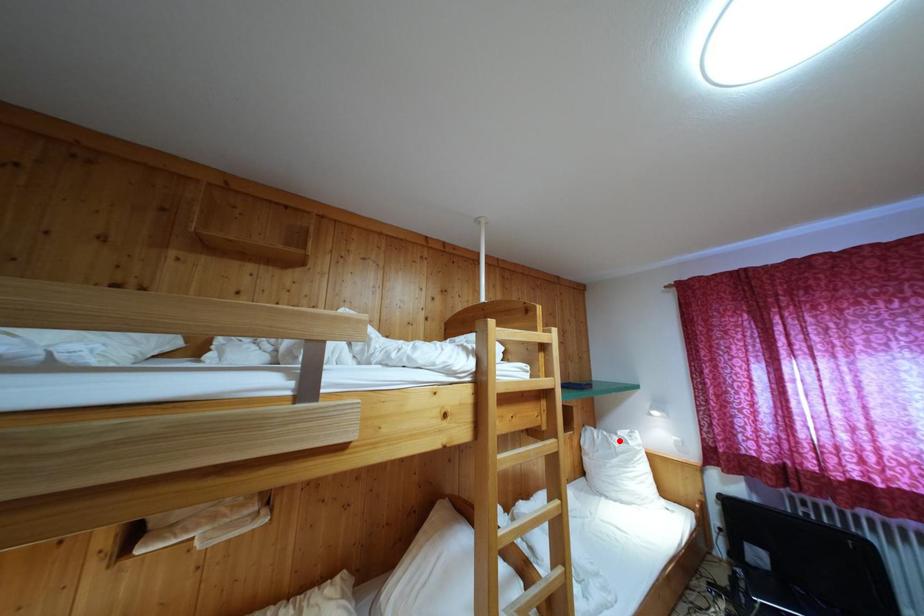
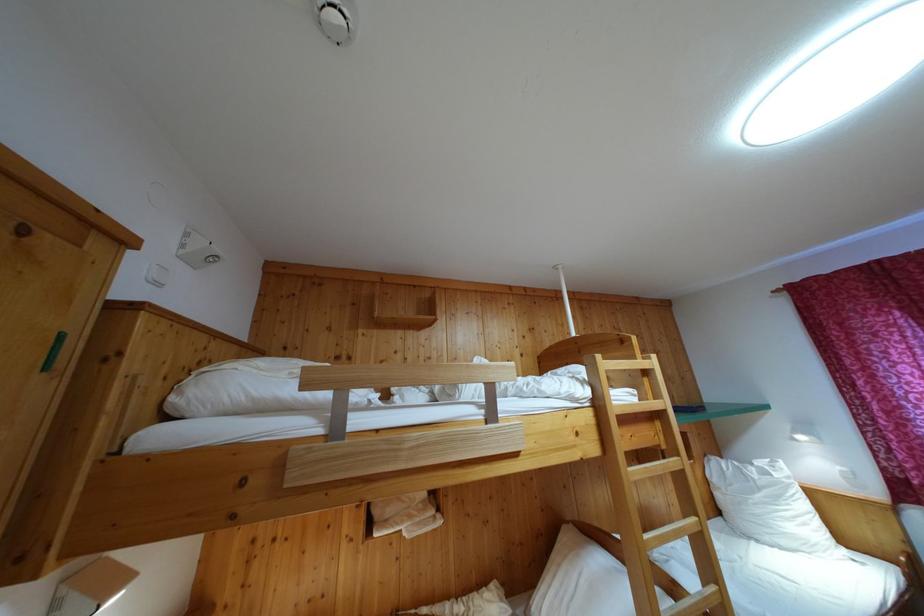
The point at the highlighted location is marked in the first image. Where is the corresponding point in the second image?

(755, 471)